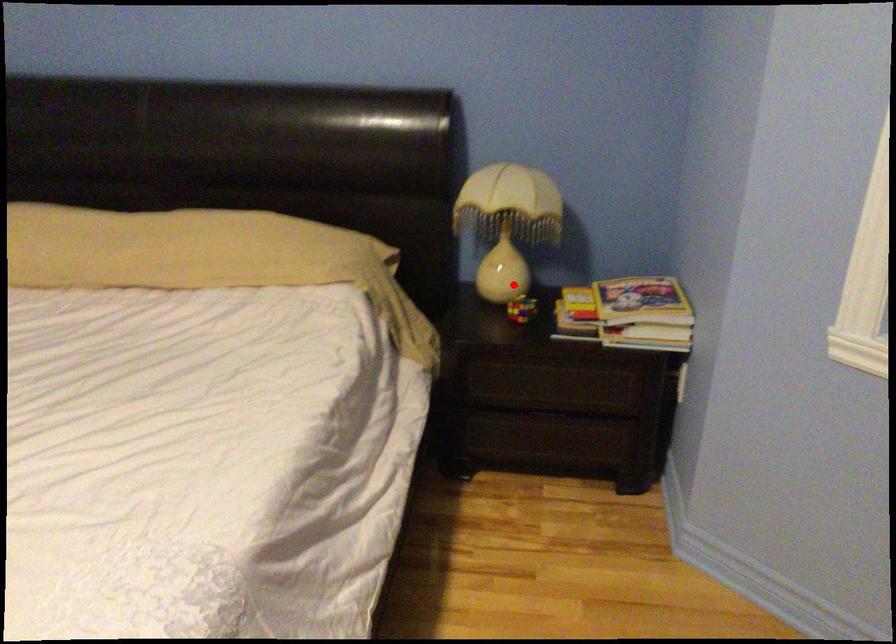
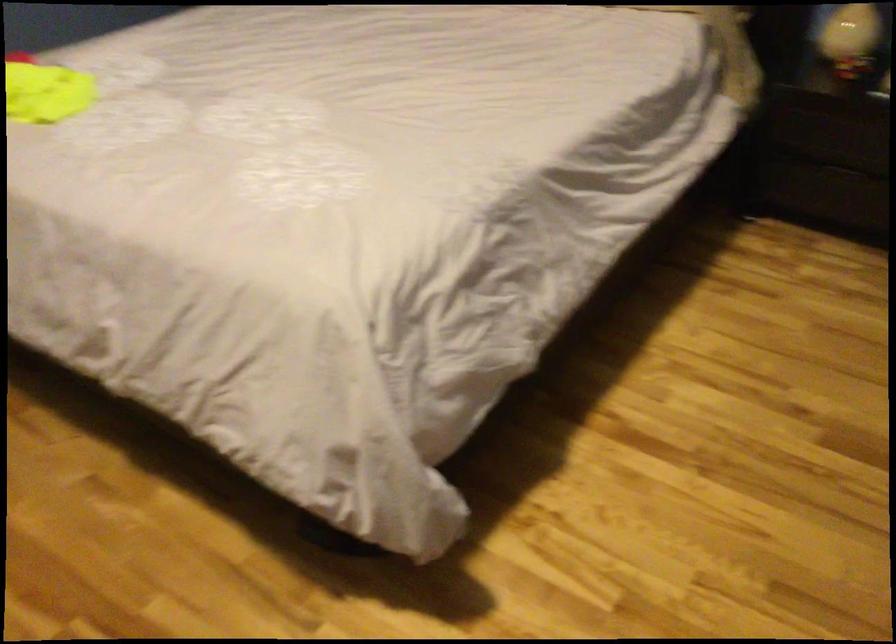
Find the pixel in the second image that matches the highlighted location in the first image.

(851, 39)